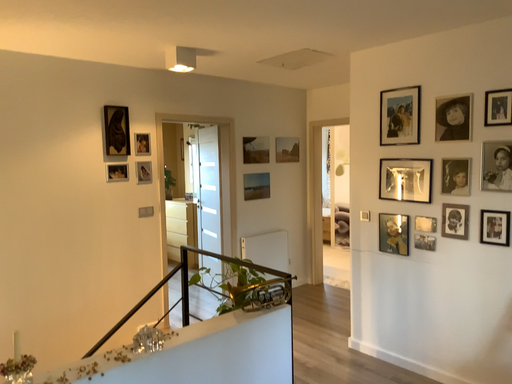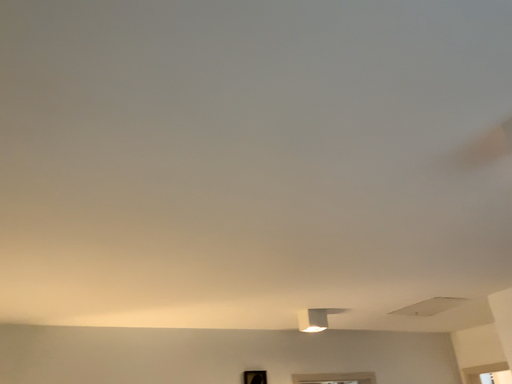
Question: Which way did the camera rotate in the video?

Choices:
 (A) rotated upward
 (B) rotated downward

Answer: (A)